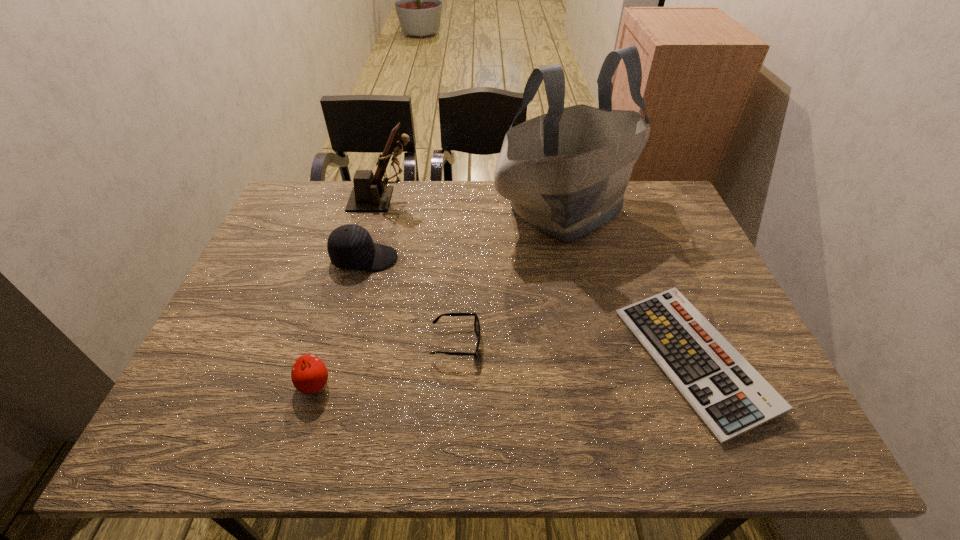
In the image, there is a desktop. At what (x,y) coordinates should I click in order to perform the action: click on free space at the far edge. Please return your answer as a coordinate pair (x, y). Image resolution: width=960 pixels, height=540 pixels. Looking at the image, I should click on (493, 217).

You are a GUI agent. You are given a task and a screenshot of the screen. Output one action in this format:
    pyautogui.click(x=<x>, y=<y>)
    Task: Click on the free spot at the near edge of the desktop
    The height and width of the screenshot is (540, 960).
    Given the screenshot: What is the action you would take?
    pyautogui.click(x=368, y=431)

Identify the location of vacant region at the left edge of the desktop. (230, 384).

In the image, there is a desktop. Identify the location of vacant space at the right edge. The height and width of the screenshot is (540, 960). click(x=719, y=302).

Where is `vacant space at the far left corner of the desktop`? The image size is (960, 540). vacant space at the far left corner of the desktop is located at coordinates (332, 199).

This screenshot has width=960, height=540. Identify the location of vacant area at the far right corner. (652, 198).

The width and height of the screenshot is (960, 540). Find the location of `vacant space that is in between the apple and the sunglasses`. vacant space that is in between the apple and the sunglasses is located at coordinates (385, 363).

The height and width of the screenshot is (540, 960). In order to click on free space between the third object from right to left and the computer keyboard in this screenshot , I will do `click(575, 351)`.

Where is `empty space that is in between the shortest object and the fourth object from left to right`? empty space that is in between the shortest object and the fourth object from left to right is located at coordinates (575, 351).

I want to click on free space between the tallest object and the third object from right to left, so click(510, 276).